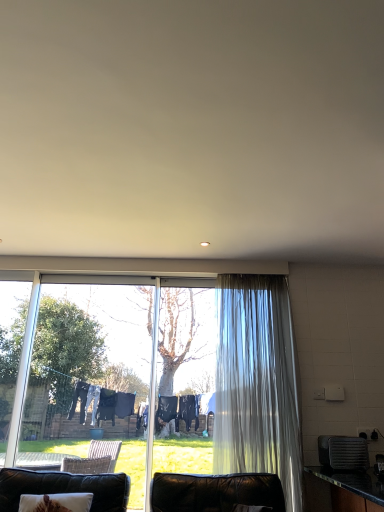
Question: Considering the relative positions of translucent fabric curtain at right and leather couch at lower left in the image provided, is translucent fabric curtain at right to the left of leather couch at lower left from the viewer's perspective?

Choices:
 (A) yes
 (B) no

Answer: (B)

Question: Can you confirm if translucent fabric curtain at right is smaller than leather couch at lower left?

Choices:
 (A) no
 (B) yes

Answer: (B)

Question: Could leather couch at lower left be considered to be inside translucent fabric curtain at right?

Choices:
 (A) yes
 (B) no

Answer: (B)

Question: Is translucent fabric curtain at right wider than leather couch at lower left?

Choices:
 (A) yes
 (B) no

Answer: (B)

Question: From the image's perspective, is translucent fabric curtain at right on top of leather couch at lower left?

Choices:
 (A) yes
 (B) no

Answer: (A)

Question: Considering the relative sizes of translucent fabric curtain at right and leather couch at lower left in the image provided, is translucent fabric curtain at right shorter than leather couch at lower left?

Choices:
 (A) yes
 (B) no

Answer: (B)

Question: Could black plastic toaster at right be considered to be inside translucent fabric curtain at right?

Choices:
 (A) no
 (B) yes

Answer: (A)

Question: Is translucent fabric curtain at right thinner than black plastic toaster at right?

Choices:
 (A) yes
 (B) no

Answer: (A)

Question: Is translucent fabric curtain at right further to the viewer compared to black plastic toaster at right?

Choices:
 (A) yes
 (B) no

Answer: (A)

Question: Considering the relative sizes of translucent fabric curtain at right and black plastic toaster at right in the image provided, is translucent fabric curtain at right taller than black plastic toaster at right?

Choices:
 (A) yes
 (B) no

Answer: (A)

Question: Is the position of translucent fabric curtain at right less distant than that of black plastic toaster at right?

Choices:
 (A) no
 (B) yes

Answer: (A)

Question: Considering the relative sizes of translucent fabric curtain at right and black plastic toaster at right in the image provided, is translucent fabric curtain at right bigger than black plastic toaster at right?

Choices:
 (A) no
 (B) yes

Answer: (B)

Question: Is black plastic toaster at right outside translucent fabric curtain at right?

Choices:
 (A) yes
 (B) no

Answer: (A)